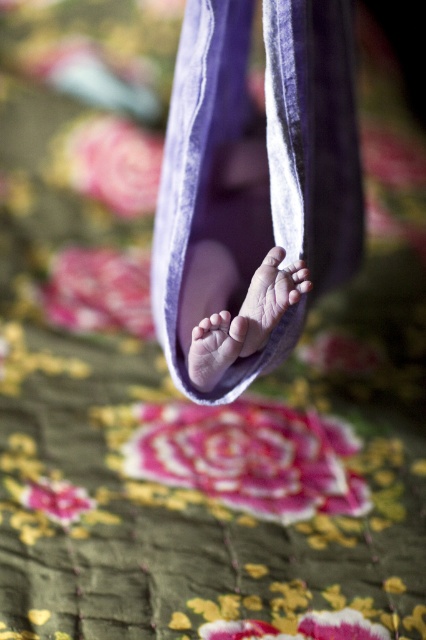
Question: Is pink soft skin at center to the right of matte pink toe at center from the viewer's perspective?

Choices:
 (A) no
 (B) yes

Answer: (B)

Question: Which of the following is the farthest from the observer?

Choices:
 (A) matte pink foot at center
 (B) pink soft skin at center
 (C) pink velvet foot at center
 (D) smooth skin foot at center

Answer: (A)

Question: Estimate the real-world distances between objects in this image. Which object is closer to the matte pink foot at center?

Choices:
 (A) matte pink toe at center
 (B) purple velvet wrap at center
 (C) pink soft skin at center

Answer: (A)

Question: Can you confirm if purple velvet wrap at center is smaller than pink velvet foot at center?

Choices:
 (A) no
 (B) yes

Answer: (A)

Question: Estimate the real-world distances between objects in this image. Which object is farther from the matte pink toe at center?

Choices:
 (A) matte pink foot at center
 (B) pink velvet foot at center
 (C) pink soft skin at center

Answer: (B)

Question: Does smooth skin foot at center have a lesser width compared to matte pink foot at center?

Choices:
 (A) yes
 (B) no

Answer: (B)